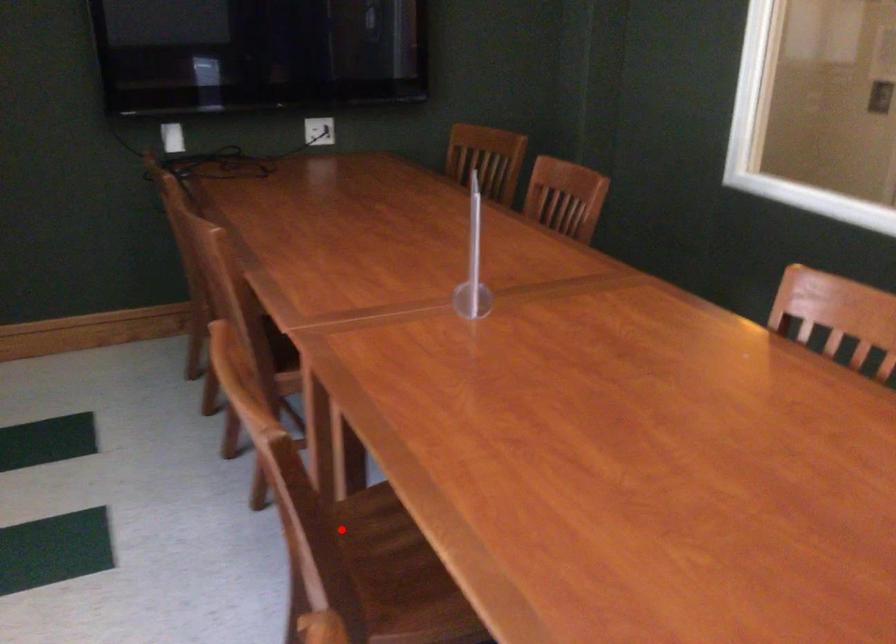
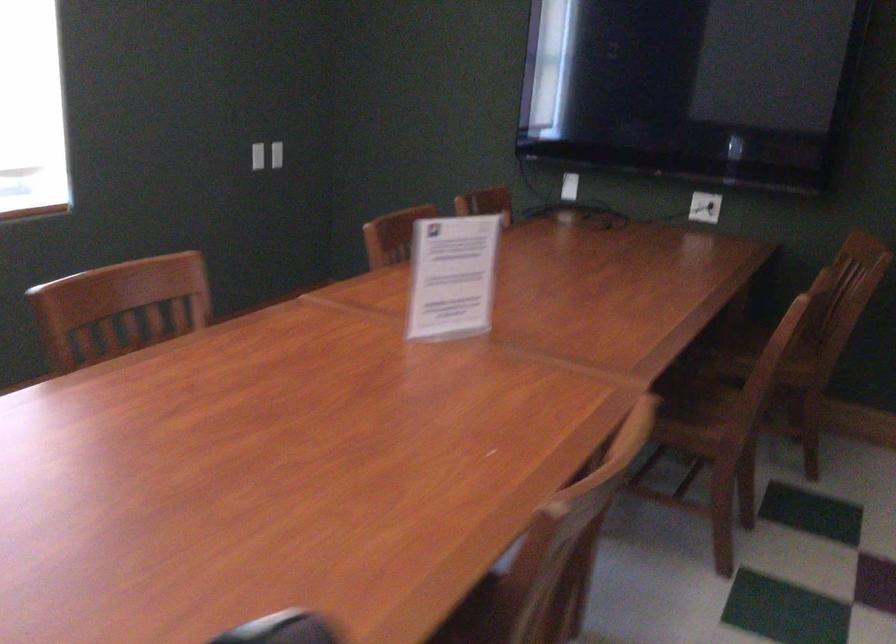
Question: I am providing you with two images of the same scene from different viewpoints. A red point is marked on the first image. Is the red point's position out of view in image 2?

Choices:
 (A) Yes
 (B) No

Answer: (A)